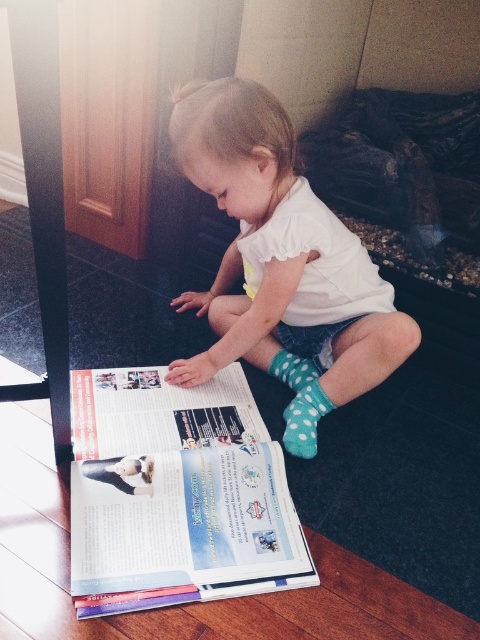
Question: Where is white glossy magazine at center located in relation to polka dot fabric sock at lower center in the image?

Choices:
 (A) left
 (B) right

Answer: (A)

Question: Can you confirm if white polka dot socks at center is smaller than blue dotted sock at lower center?

Choices:
 (A) yes
 (B) no

Answer: (B)

Question: Can you confirm if white glossy magazine at center is positioned to the left of blue dotted sock at lower center?

Choices:
 (A) no
 (B) yes

Answer: (B)

Question: Among these objects, which one is farthest from the camera?

Choices:
 (A) white polka dot socks at center
 (B) blue dotted sock at lower center
 (C) white glossy magazine at center

Answer: (B)

Question: Which point is closer to the camera?

Choices:
 (A) (314, 408)
 (B) (279, 349)

Answer: (A)

Question: Estimate the real-world distances between objects in this image. Which object is closer to the white glossy magazine at center?

Choices:
 (A) blue dotted sock at lower center
 (B) white polka dot socks at center
 (C) polka dot fabric sock at lower center

Answer: (A)